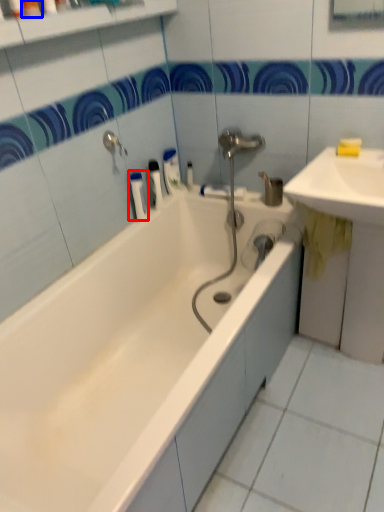
Question: Which object is further to the camera taking this photo, toiletry (highlighted by a red box) or toiletry (highlighted by a blue box)?

Choices:
 (A) toiletry
 (B) toiletry

Answer: (A)